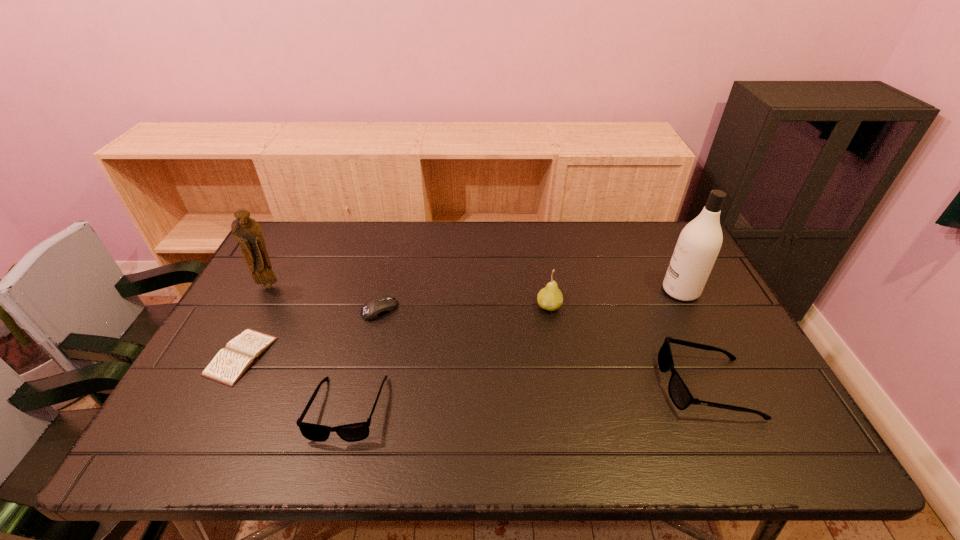
At what (x,y) coordinates should I click in order to perform the action: click on diary that is positioned at the near edge. Please return your answer as a coordinate pair (x, y). Image resolution: width=960 pixels, height=540 pixels. Looking at the image, I should click on (230, 363).

Locate an element on the screen. Image resolution: width=960 pixels, height=540 pixels. figurine that is at the left edge is located at coordinates (247, 232).

At what (x,y) coordinates should I click in order to perform the action: click on diary located at the left edge. Please return your answer as a coordinate pair (x, y). The image size is (960, 540). Looking at the image, I should click on (230, 363).

Identify the location of sunglasses present at the right edge. The width and height of the screenshot is (960, 540). (680, 395).

Where is `shampoo located at the right edge`? shampoo located at the right edge is located at coordinates coord(699,243).

The width and height of the screenshot is (960, 540). I want to click on object located at the near left corner, so click(x=230, y=363).

Identify the location of object that is at the near right corner. (680, 395).

In the image, there is a desktop. At what (x,y) coordinates should I click in order to perform the action: click on vacant region at the far edge. Please return your answer as a coordinate pair (x, y). The image size is (960, 540). Looking at the image, I should click on (476, 259).

Locate an element on the screen. This screenshot has height=540, width=960. free region at the near edge is located at coordinates (526, 406).

At what (x,y) coordinates should I click in order to perform the action: click on vacant point at the left edge. Please return your answer as a coordinate pair (x, y). The image size is (960, 540). Looking at the image, I should click on (285, 307).